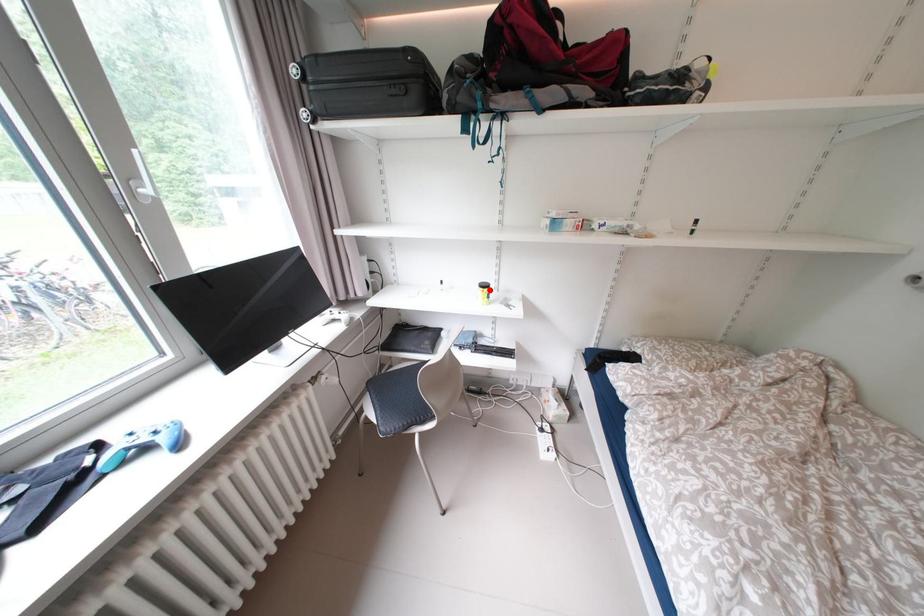
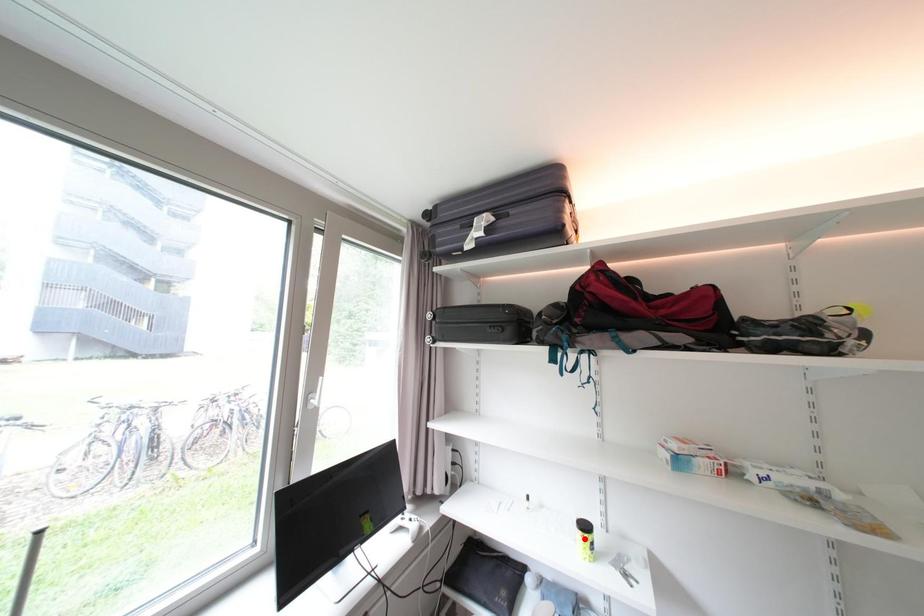
I am providing you with two images of the same scene from different viewpoints. A red point is marked on the first image and another point is marked on the second image. Is the marked point in image1 the same physical position as the marked point in image2?

No